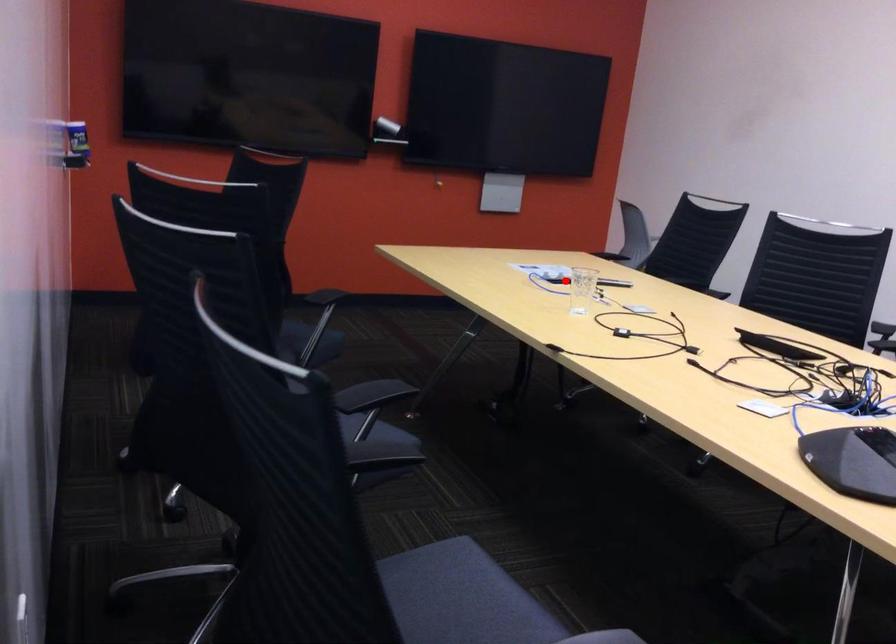
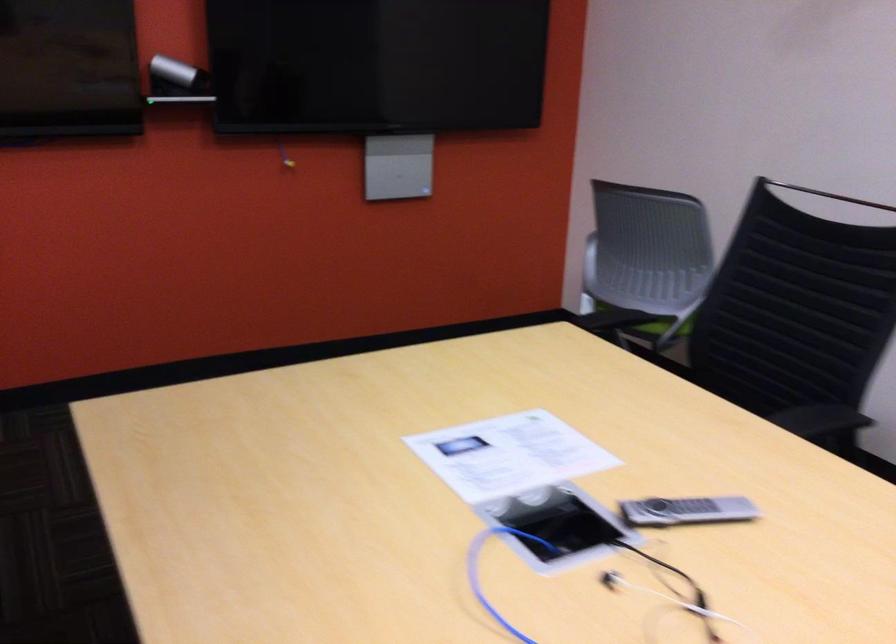
Question: I am providing you with two images of the same scene from different viewpoints. Image1 has a red point marked. In image2, the corresponding 3D location appears at what relative position? Reply with the corresponding letter.

Choices:
 (A) Closer
 (B) Farther

Answer: (A)